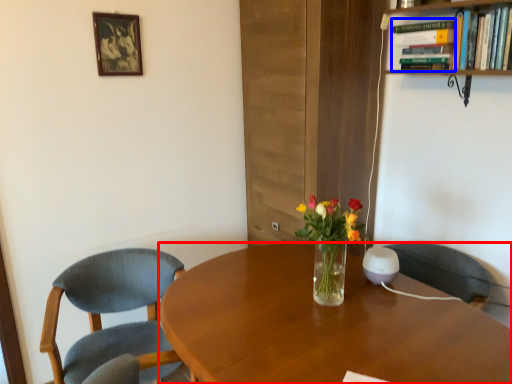
Question: Which of the following is the farthest to the observer, desk (highlighted by a red box) or book (highlighted by a blue box)?

Choices:
 (A) desk
 (B) book

Answer: (B)